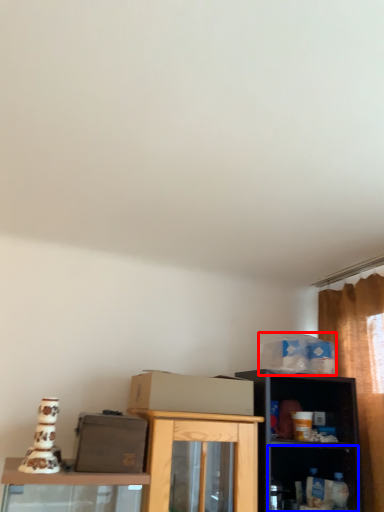
Question: Which object is closer to the camera taking this photo, box (highlighted by a red box) or shelf (highlighted by a blue box)?

Choices:
 (A) box
 (B) shelf

Answer: (B)